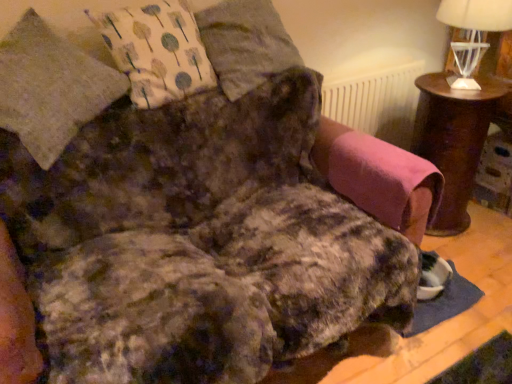
Question: Is brown wooden table at right positioned before white glass table lamp at upper right?

Choices:
 (A) no
 (B) yes

Answer: (A)

Question: Does brown wooden table at right have a lesser height compared to white glass table lamp at upper right?

Choices:
 (A) no
 (B) yes

Answer: (A)

Question: From the image's perspective, is brown wooden table at right on top of white glass table lamp at upper right?

Choices:
 (A) no
 (B) yes

Answer: (A)

Question: From the image's perspective, is brown wooden table at right below white glass table lamp at upper right?

Choices:
 (A) no
 (B) yes

Answer: (B)

Question: Is brown wooden table at right not within white glass table lamp at upper right?

Choices:
 (A) no
 (B) yes

Answer: (B)

Question: Based on their positions, is fluffy gray pillow at upper center, which is counted as the 2th pillow, starting from the left, located to the left or right of white textured radiator at upper center?

Choices:
 (A) right
 (B) left

Answer: (B)

Question: Is fluffy gray pillow at upper center, which is counted as the 2th pillow, starting from the left, inside or outside of white textured radiator at upper center?

Choices:
 (A) inside
 (B) outside

Answer: (B)

Question: Looking at the image, does fluffy gray pillow at upper center, the 1th pillow positioned from the right, seem bigger or smaller compared to white textured radiator at upper center?

Choices:
 (A) big
 (B) small

Answer: (A)

Question: From a real-world perspective, is fluffy gray pillow at upper center, the 1th pillow positioned from the right, positioned above or below white textured radiator at upper center?

Choices:
 (A) above
 (B) below

Answer: (A)

Question: Considering the positions of point (62, 59) and point (274, 46), is point (62, 59) closer or farther from the camera than point (274, 46)?

Choices:
 (A) farther
 (B) closer

Answer: (B)

Question: Considering their positions, is fluffy gray pillow at upper left, which is the second pillow from right to left, located in front of or behind fluffy gray pillow at upper center, the 1th pillow positioned from the right?

Choices:
 (A) behind
 (B) front

Answer: (B)

Question: From a real-world perspective, relative to fluffy gray pillow at upper center, the 1th pillow positioned from the right, is fluffy gray pillow at upper left, which is the first pillow in left-to-right order, vertically above or below?

Choices:
 (A) below
 (B) above

Answer: (A)

Question: From the image's perspective, is fluffy gray pillow at upper left, which is the first pillow in left-to-right order, above or below fluffy gray pillow at upper center, the 1th pillow positioned from the right?

Choices:
 (A) below
 (B) above

Answer: (A)

Question: In the image, is white textured radiator at upper center on the left side or the right side of fluffy gray pillow at upper center, the 1th pillow positioned from the right?

Choices:
 (A) left
 (B) right

Answer: (B)

Question: Relative to fluffy gray pillow at upper center, the 1th pillow positioned from the right, is white textured radiator at upper center in front or behind?

Choices:
 (A) front
 (B) behind

Answer: (B)